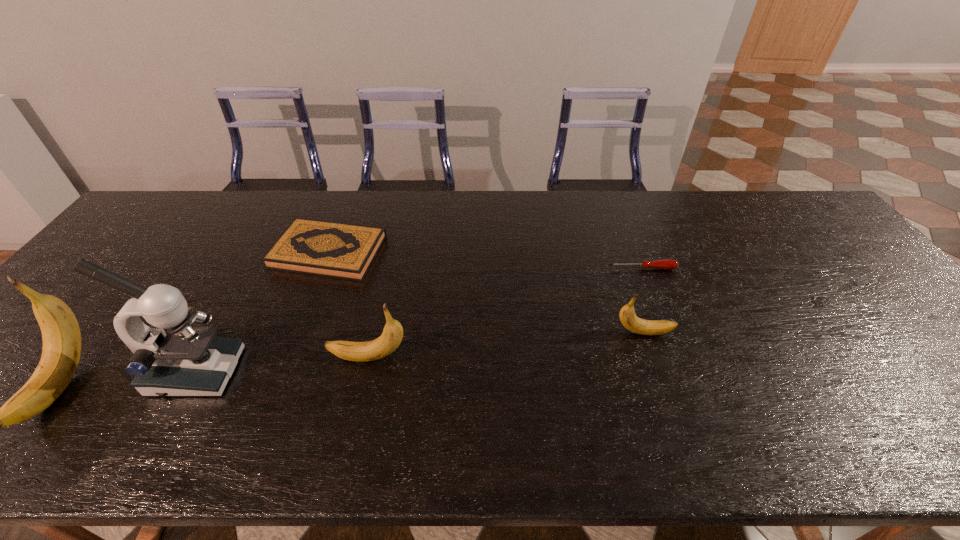
I want to click on object that is at the near left corner, so click(61, 335).

This screenshot has height=540, width=960. In the image, there is a desktop. What are the coordinates of `blank space at the far edge` in the screenshot? It's located at (684, 221).

Where is `free space at the near edge`? This screenshot has width=960, height=540. free space at the near edge is located at coordinates (641, 381).

Find the location of a particular element. The height and width of the screenshot is (540, 960). free space at the right edge of the desktop is located at coordinates coord(871,308).

In order to click on free space at the far right corner of the desktop in this screenshot , I will do `click(757, 202)`.

The width and height of the screenshot is (960, 540). What are the coordinates of `vacant space in between the microscope and the tallest banana` in the screenshot? It's located at (129, 379).

Image resolution: width=960 pixels, height=540 pixels. I want to click on unoccupied position between the hardback book and the farthest banana, so 486,292.

The height and width of the screenshot is (540, 960). I want to click on vacant point located between the second banana from left to right and the microscope, so click(x=282, y=365).

This screenshot has height=540, width=960. I want to click on unoccupied position between the third tallest object and the shortest banana, so click(x=506, y=345).

Locate an element on the screen. Image resolution: width=960 pixels, height=540 pixels. free spot between the second tallest object and the microscope is located at coordinates (129, 379).